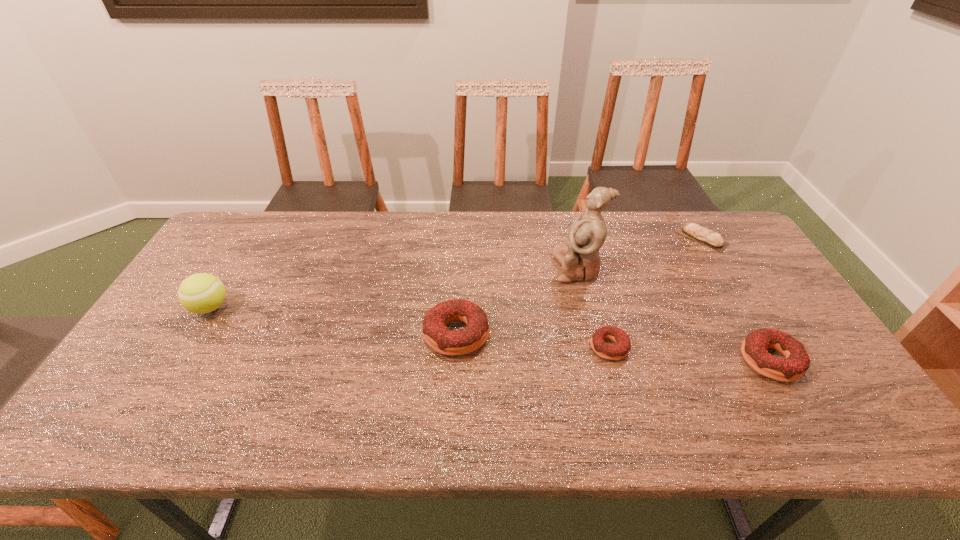
At what (x,y) coordinates should I click in order to perform the action: click on the fifth object from right to left. Please return your answer as a coordinate pair (x, y). Looking at the image, I should click on (436, 334).

The image size is (960, 540). Find the location of `the second doughnut from left to right`. the second doughnut from left to right is located at coordinates (612, 352).

Where is `the third shortest object`? Image resolution: width=960 pixels, height=540 pixels. the third shortest object is located at coordinates (795, 364).

I want to click on the second tallest doughnut, so click(795, 364).

Find the location of `pita bread`. pita bread is located at coordinates pos(703,235).

Locate an element on the screen. This screenshot has height=540, width=960. the tallest object is located at coordinates (579, 258).

Where is `the second tallest object`? the second tallest object is located at coordinates (201, 293).

Find the location of `the leftmost object`. the leftmost object is located at coordinates (201, 293).

Where is `vacant space situated 0.210m on the right of the second object from left to right`? vacant space situated 0.210m on the right of the second object from left to right is located at coordinates (568, 334).

Identify the location of vacant space located 0.240m on the back of the shortest doughnut. Image resolution: width=960 pixels, height=540 pixels. (589, 272).